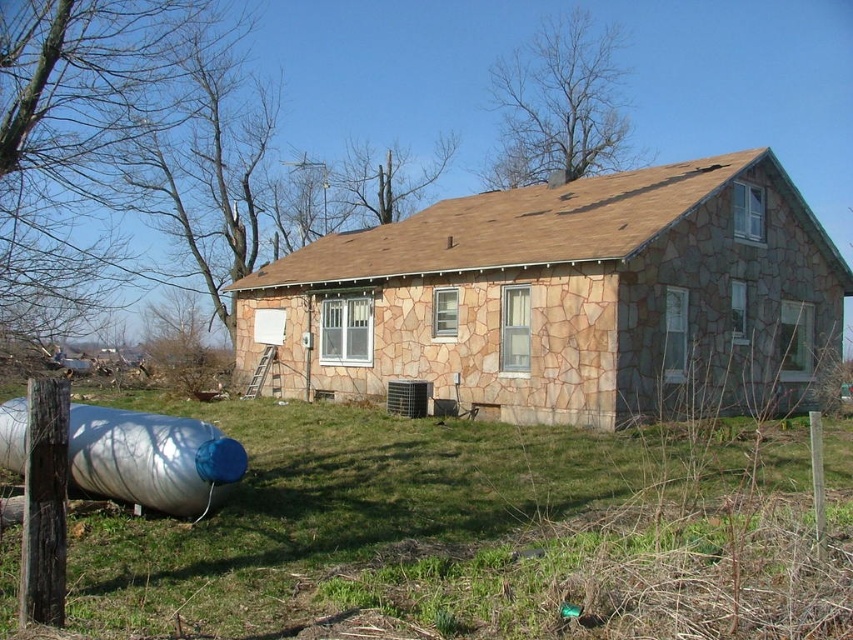
Based on the photo, you are standing in the yard and want to walk towards the stone textured house at center. Which direction should you move relative to the green grass at lower center?

You should move away from the green grass at lower center towards the stone textured house at center since the grass is in front of the house.

You are planning to install a new garden in the area where the green grass at lower center and the stone textured house at center are located. Which area has more space available for planting?

The stone textured house at center occupies more space than the green grass at lower center, so the area around the green grass at lower center has less space available for planting.